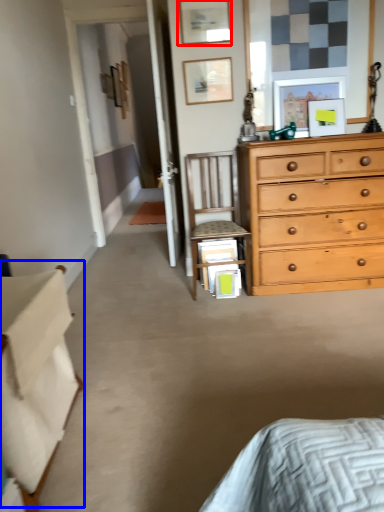
Question: Which point is further to the camera, picture frame (highlighted by a red box) or table (highlighted by a blue box)?

Choices:
 (A) picture frame
 (B) table

Answer: (A)